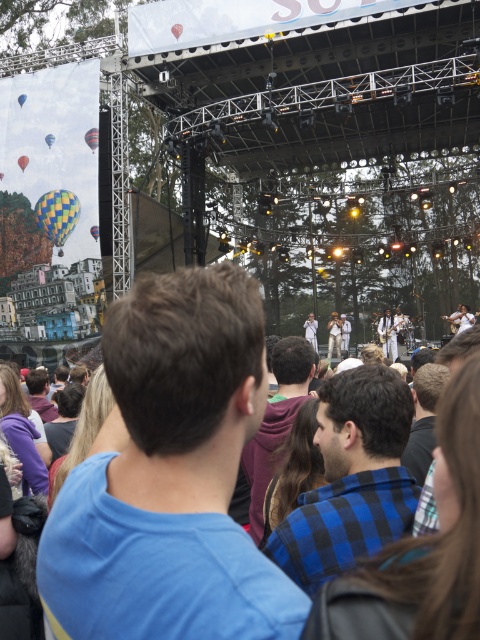
Question: Which point is closer to the camera taking this photo?

Choices:
 (A) (52, 230)
 (B) (87, 136)
 (C) (96, 236)

Answer: (C)

Question: Is multicolored fabric hot air balloon at upper left closer to camera compared to checkered fabric hot air balloon at upper left?

Choices:
 (A) yes
 (B) no

Answer: (B)

Question: Which point appears closest to the camera in this image?

Choices:
 (A) (94, 131)
 (B) (59, 225)

Answer: (A)

Question: Which point is farther from the camera taking this photo?

Choices:
 (A) pyautogui.click(x=45, y=227)
 (B) pyautogui.click(x=94, y=147)
 (C) pyautogui.click(x=97, y=230)

Answer: (A)

Question: Can you confirm if checkered fabric balloon at upper left is wider than checkered fabric hot air balloon at upper left?

Choices:
 (A) no
 (B) yes

Answer: (A)

Question: Is multicolored fabric hot air balloon at upper left smaller than checkered fabric hot air balloon at upper left?

Choices:
 (A) no
 (B) yes

Answer: (A)